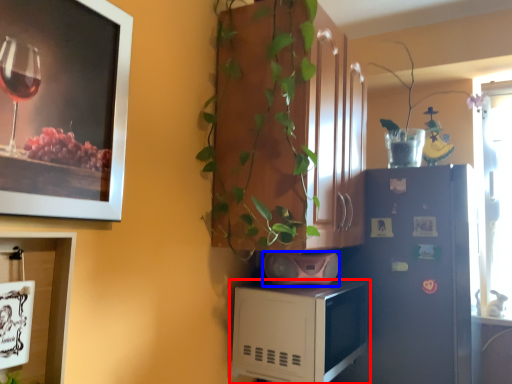
Question: Which object appears closest to the camera in this image, microwave oven (highlighted by a red box) or appliance (highlighted by a blue box)?

Choices:
 (A) microwave oven
 (B) appliance

Answer: (A)